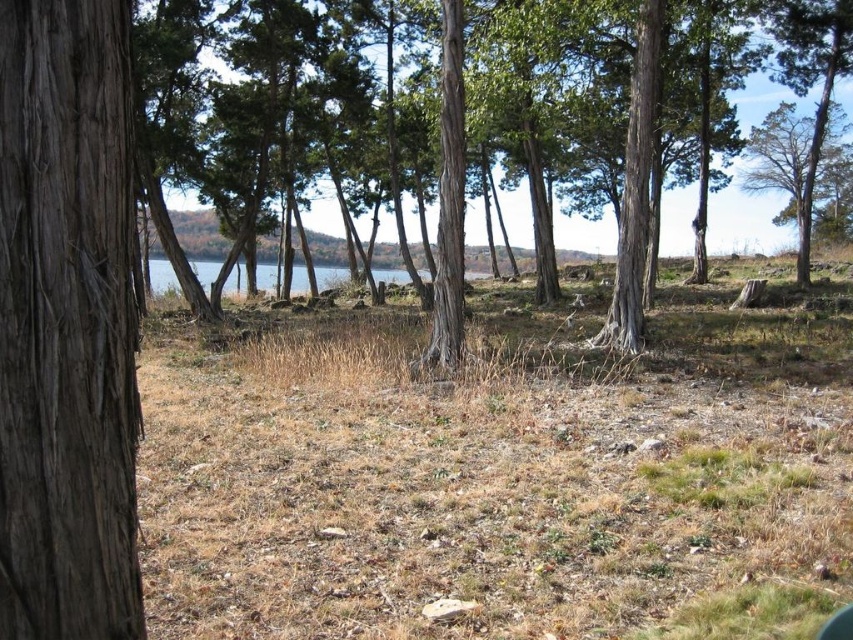
Question: Which object is farther from the camera taking this photo?

Choices:
 (A) brown rough bark tree at left
 (B) green rough bark tree at center

Answer: (B)

Question: Which point is farther to the camera?

Choices:
 (A) (808, 49)
 (B) (91, 81)

Answer: (A)

Question: Is brown rough bark tree at left positioned before green rough bark tree at center?

Choices:
 (A) yes
 (B) no

Answer: (A)

Question: Is brown rough bark tree at left thinner than green rough bark tree at center?

Choices:
 (A) no
 (B) yes

Answer: (B)

Question: In this image, where is brown rough bark tree at left located relative to green rough bark tree at center?

Choices:
 (A) right
 (B) left

Answer: (B)